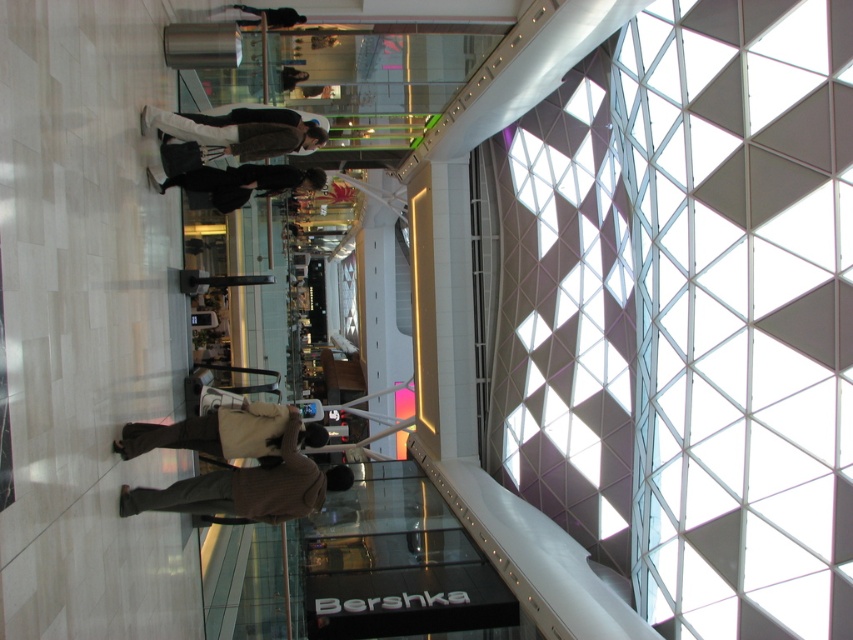
You are a delivery robot with a 1.2 meter wide package. You need to navigate through the mall and pass between the brown wool sweater at center and the brown wool coat at center. Can your package fit through the space between them?

The distance between the brown wool sweater at center and the brown wool coat at center is 1.17 meters. Since your package is 1.2 meters wide, it is slightly wider than the available space. Therefore, the package cannot fit through the gap between them.